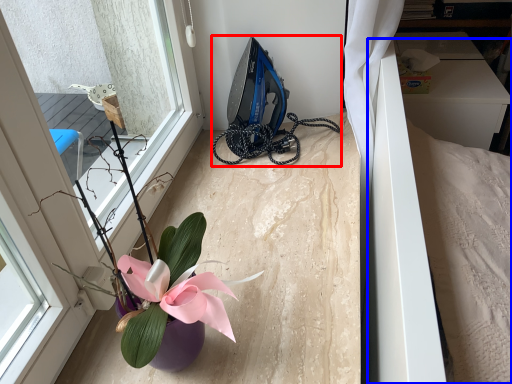
Question: Which point is further to the camera, equipment (highlighted by a red box) or bed (highlighted by a blue box)?

Choices:
 (A) equipment
 (B) bed

Answer: (B)